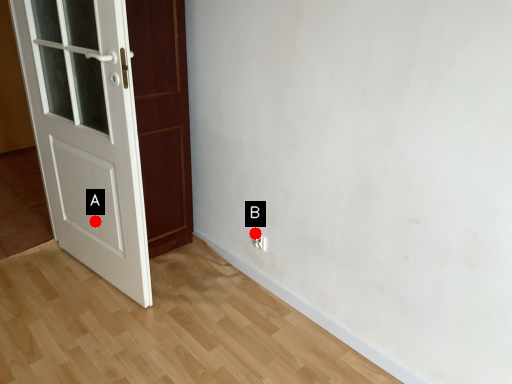
Question: Two points are circled on the image, labeled by A and B beside each circle. Among these points, which one is nearest to the camera?

Choices:
 (A) A is closer
 (B) B is closer

Answer: (A)